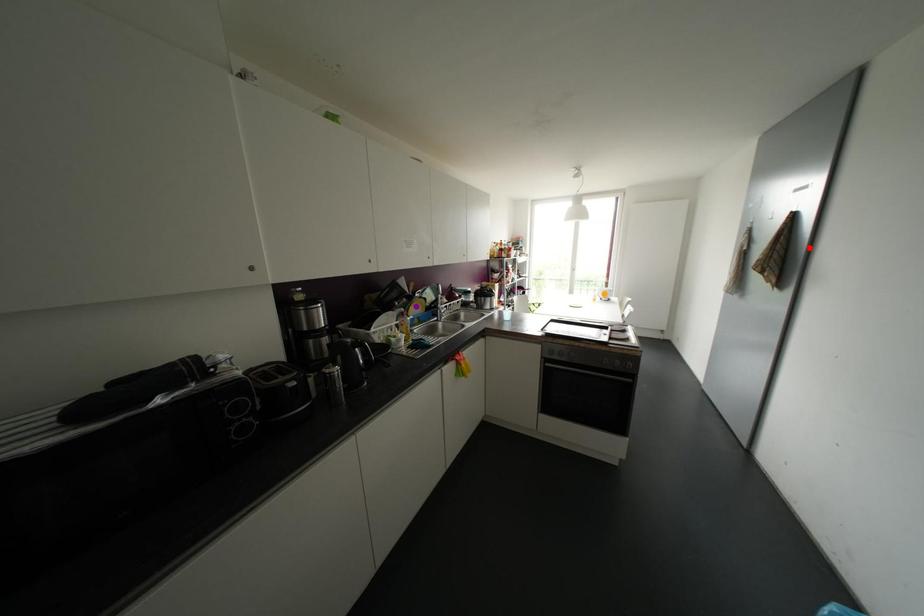
Order these from nearest to farthest:
- purple point
- orange point
- red point

red point, purple point, orange point